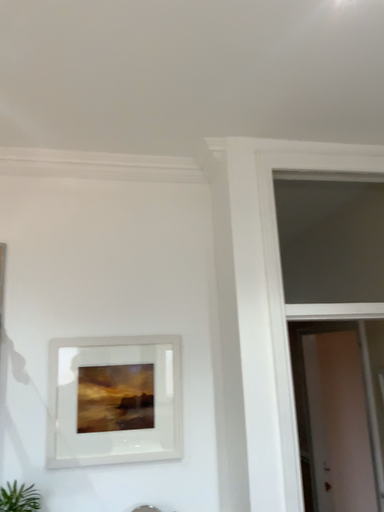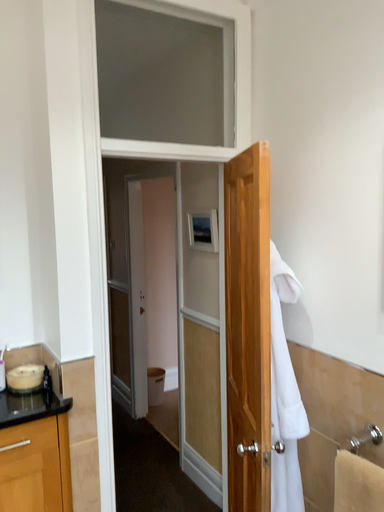
Question: How did the camera likely rotate when shooting the video?

Choices:
 (A) rotated left
 (B) rotated right

Answer: (B)